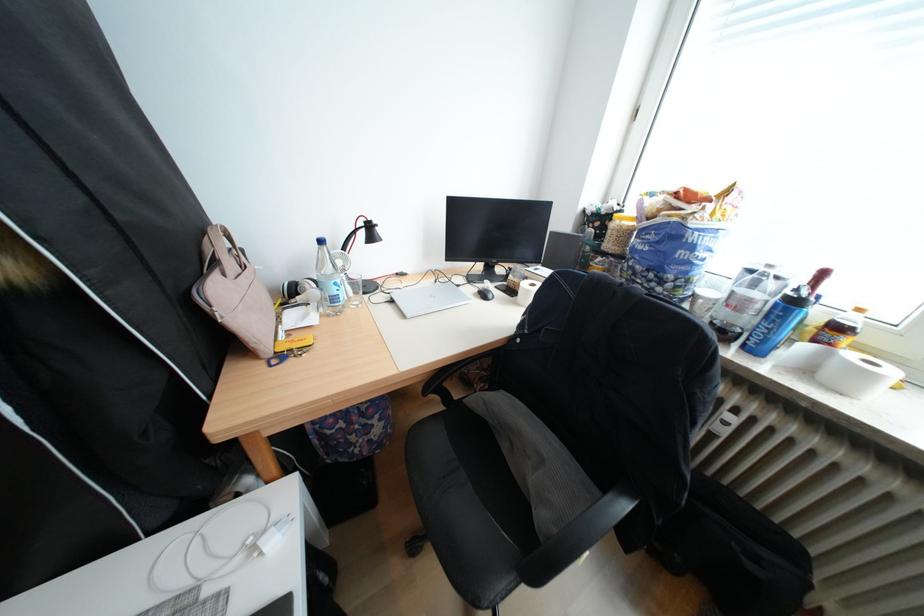
What do you see at coordinates (329, 280) in the screenshot?
I see `the blue water bottle` at bounding box center [329, 280].